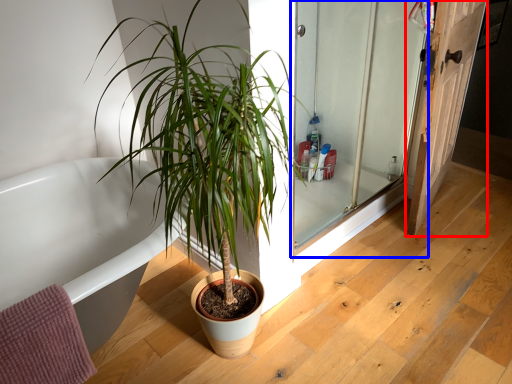
Question: Which point is closer to the camera, door (highlighted by a red box) or screen door (highlighted by a blue box)?

Choices:
 (A) door
 (B) screen door

Answer: (B)